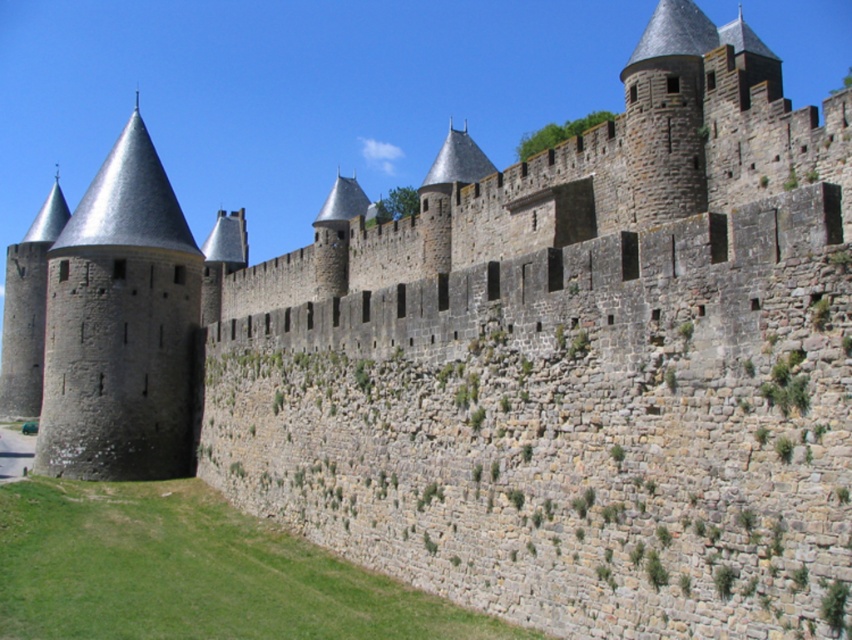
The height and width of the screenshot is (640, 852). What do you see at coordinates (193, 572) in the screenshot?
I see `green grass at lower left` at bounding box center [193, 572].

Between green grass at lower left and dark gray stone tower at left, which one has more height?

dark gray stone tower at left

I want to click on green grass at lower left, so click(193, 572).

This screenshot has height=640, width=852. I want to click on green grass at lower left, so click(x=193, y=572).